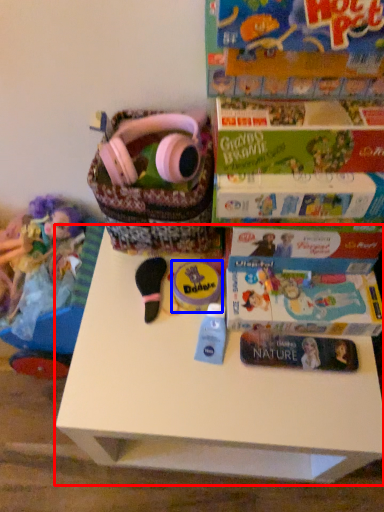
Question: Which of the following is the closest to the observer, table (highlighted by a red box) or toy (highlighted by a blue box)?

Choices:
 (A) table
 (B) toy

Answer: (A)